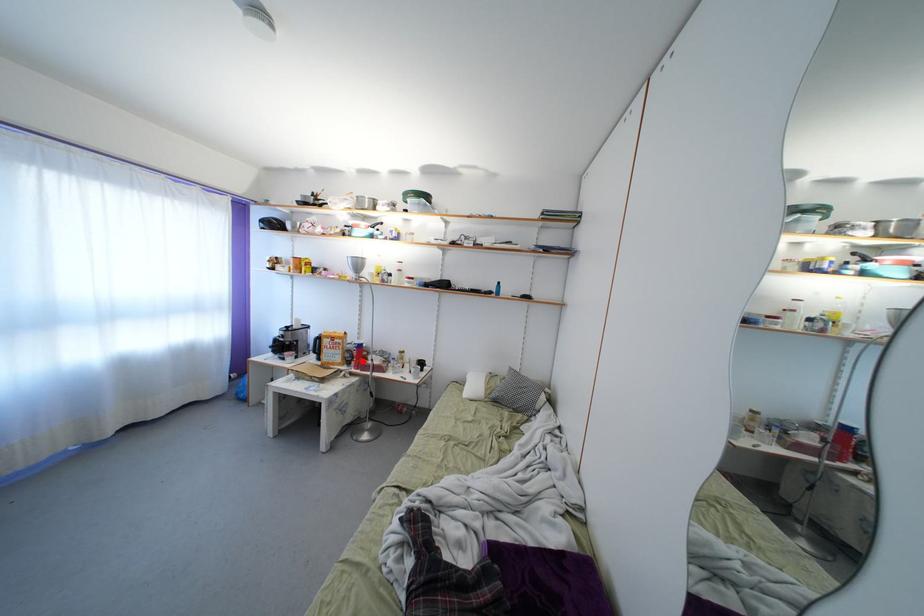
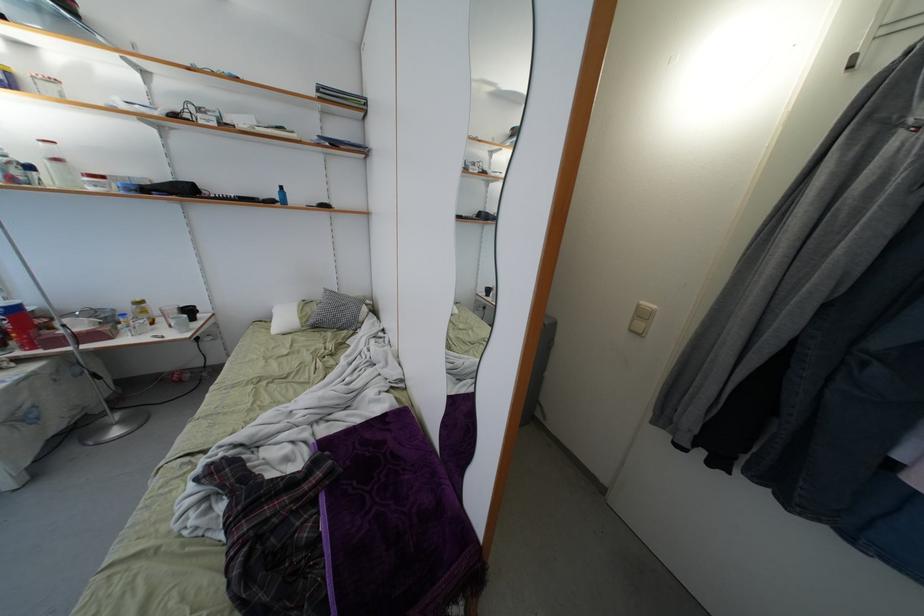
Locate, in the second image, the point that corresponds to the highlighted location in the first image.

(22, 333)